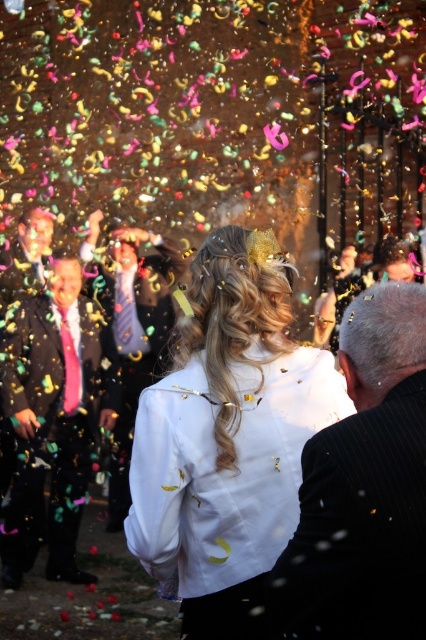
You are a photographer at a wedding. You need to capture a photo that includes both the white satin dress at center and the black pinstripe suit at right. Based on their positions, where should you position yourself to ensure both are in frame?

Since the white satin dress at center is located above the black pinstripe suit at right, you should position yourself slightly below the white satin dress at center to ensure both are visible in the frame.

You are a photographer at a wedding. You need to capture a photo of the black pinstripe suit at right and the shiny pink tie at left. The camera you are using has a maximum focus range of 18 feet. Will you be able to capture both subjects in focus?

The distance between the black pinstripe suit at right and the shiny pink tie at left is 18.15 feet. Since the camera can only focus up to 18 feet, the subjects are slightly out of the focus range. Therefore, you won